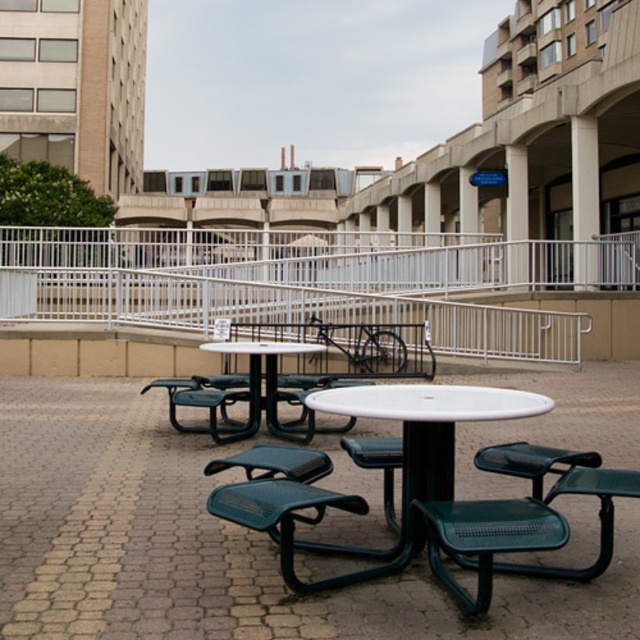
Is point (4, 280) in front of point (522, 170)?

Yes, point (4, 280) is in front of point (522, 170).

Which is more to the right, white metal rail at upper center or white concrete pillar at center?

white concrete pillar at center

Locate an element on the screen. This screenshot has height=640, width=640. white metal rail at upper center is located at coordinates [x=317, y=282].

Does white plastic table at center have a greater height compared to green plastic table at center?

No, white plastic table at center is not taller than green plastic table at center.

Describe the element at coordinates (429, 403) in the screenshot. Image resolution: width=640 pixels, height=640 pixels. I see `white plastic table at center` at that location.

You are a GUI agent. You are given a task and a screenshot of the screen. Output one action in this format:
    pyautogui.click(x=<x>, y=<y>)
    Task: Click on the white plastic table at center
    
    Given the screenshot: What is the action you would take?
    [429, 403]

Locate an element on the screen. The image size is (640, 640). white plastic table at center is located at coordinates (429, 403).

Does white concrete pillar at upper center have a lesser height compared to green plastic chair at center?

Incorrect, white concrete pillar at upper center's height does not fall short of green plastic chair at center's.

Does point (589, 129) lie in front of point (220, 378)?

No, (589, 129) is behind (220, 378).

Is point (572, 116) closer to camera compared to point (172, 401)?

No, it is not.

Identify the location of white concrete pillar at upper center. The image size is (640, 640). (584, 198).